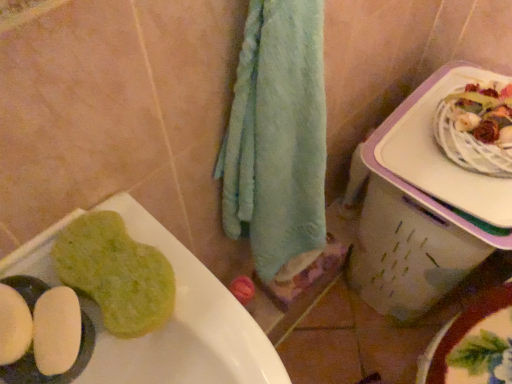
Find the location of a particular element. white plastic lunch box at right is located at coordinates (422, 206).

In the scene shown: From the image's perspective, is green sponge at lower left above or below white plastic lunch box at right?

green sponge at lower left is situated lower than white plastic lunch box at right in the image.

This screenshot has height=384, width=512. Find the location of `food above the white plastic lunch box at right (from a real-world perspective)`. food above the white plastic lunch box at right (from a real-world perspective) is located at coordinates (115, 273).

In the scene shown: Is green sponge at lower left not within white plastic lunch box at right?

Indeed, green sponge at lower left is completely outside white plastic lunch box at right.

In the scene shown: Does green sponge at lower left turn towards white plastic lunch box at right?

No, green sponge at lower left is not oriented towards white plastic lunch box at right.

Between green sponge at lower left and green sponge at lower left, which one appears on the right side from the viewer's perspective?

green sponge at lower left is more to the right.

The image size is (512, 384). In the image, there is a green sponge at lower left. What are the coordinates of `sink below it (from a real-world perspective)` in the screenshot? It's located at (183, 325).

Is green sponge at lower left oriented away from green sponge at lower left?

Yes, green sponge at lower left is facing away from green sponge at lower left.

Considering the points (64, 235) and (169, 368), which point is behind, point (64, 235) or point (169, 368)?

The point (169, 368) is farther from the camera.

Looking at this image, does white plastic lunch box at right appear on the left side of green sponge at lower left?

No.

Is white plastic lunch box at right positioned before green sponge at lower left?

No, it is behind green sponge at lower left.

Is white plastic lunch box at right completely or partially outside of green sponge at lower left?

Yes, white plastic lunch box at right is not within green sponge at lower left.

From the image's perspective, is white plastic lunch box at right above or below green sponge at lower left?

From the image's perspective, white plastic lunch box at right appears above green sponge at lower left.

Is green sponge at lower left surrounding white plastic lunch box at right?

No, white plastic lunch box at right is located outside of green sponge at lower left.

Consider the image. Between green sponge at lower left and white plastic lunch box at right, which one is positioned behind?

white plastic lunch box at right.

From the picture: From a real-world perspective, relative to white plastic lunch box at right, is green sponge at lower left vertically above or below?

From a real-world perspective, green sponge at lower left is physically above white plastic lunch box at right.

Considering the relative sizes of white plastic lunch box at right and green sponge at lower left in the image provided, is white plastic lunch box at right shorter than green sponge at lower left?

In fact, white plastic lunch box at right may be taller than green sponge at lower left.

From the image's perspective, who appears lower, white plastic lunch box at right or green sponge at lower left?

green sponge at lower left, from the image's perspective.

Relative to green sponge at lower left, is white plastic lunch box at right in front or behind?

In the image, white plastic lunch box at right appears behind green sponge at lower left.

Between green sponge at lower left and green sponge at lower left, which one appears on the right side from the viewer's perspective?

Positioned to the right is green sponge at lower left.

Is green sponge at lower left behind green sponge at lower left?

That is False.

Does green sponge at lower left have a lesser height compared to green sponge at lower left?

Incorrect, the height of green sponge at lower left does not fall short of that of green sponge at lower left.

From the image's perspective, which object appears higher, green sponge at lower left or green sponge at lower left?

green sponge at lower left is shown above in the image.

This screenshot has height=384, width=512. Identify the location of food on the left of the white plastic lunch box at right. (115, 273).

The image size is (512, 384). I want to click on food behind the green sponge at lower left, so click(115, 273).

When comparing their distances from white plastic lunch box at right, does green sponge at lower left or green sponge at lower left seem further?

green sponge at lower left is positioned further to the anchor white plastic lunch box at right.

Based on their spatial positions, is green sponge at lower left or white plastic lunch box at right further from green sponge at lower left?

The object further to green sponge at lower left is white plastic lunch box at right.

Considering their positions, is green sponge at lower left positioned further to green sponge at lower left than white plastic lunch box at right?

white plastic lunch box at right.

From the image, which object appears to be farther from green sponge at lower left, white plastic lunch box at right or green sponge at lower left?

white plastic lunch box at right.

Looking at the image, which one is located further to white plastic lunch box at right, green sponge at lower left or green sponge at lower left?

green sponge at lower left is further to white plastic lunch box at right.

Looking at this image, which object lies further to the anchor point green sponge at lower left, white plastic lunch box at right or green sponge at lower left?

Among the two, white plastic lunch box at right is located further to green sponge at lower left.

You are a GUI agent. You are given a task and a screenshot of the screen. Output one action in this format:
    pyautogui.click(x=<x>, y=<y>)
    Task: Click on the sink between green sponge at lower left and white plastic lunch box at right
    
    Given the screenshot: What is the action you would take?
    pyautogui.click(x=183, y=325)